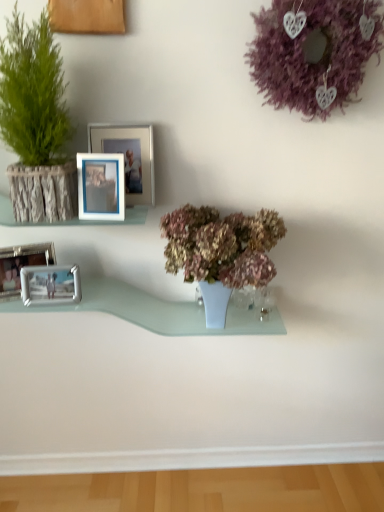
Question: From a real-world perspective, is purple matte wreath at upper right below metallic silver picture frame at left, the 3th picture frame viewed from the right?

Choices:
 (A) yes
 (B) no

Answer: (B)

Question: Considering the relative sizes of purple matte wreath at upper right and metallic silver picture frame at left, the second picture frame when ordered from left to right, in the image provided, is purple matte wreath at upper right thinner than metallic silver picture frame at left, the second picture frame when ordered from left to right,?

Choices:
 (A) no
 (B) yes

Answer: (A)

Question: Is purple matte wreath at upper right not near metallic silver picture frame at left, the 3th picture frame viewed from the right?

Choices:
 (A) no
 (B) yes

Answer: (A)

Question: Is purple matte wreath at upper right bigger than metallic silver picture frame at left, the second picture frame when ordered from left to right?

Choices:
 (A) no
 (B) yes

Answer: (B)

Question: Is purple matte wreath at upper right not inside metallic silver picture frame at left, the 3th picture frame viewed from the right?

Choices:
 (A) no
 (B) yes

Answer: (B)

Question: From the image's perspective, is purple matte wreath at upper right on metallic silver picture frame at left, the 3th picture frame viewed from the right?

Choices:
 (A) yes
 (B) no

Answer: (A)

Question: Is clear glass shelf at center wider than metallic silver picture frame at left, the 3th picture frame viewed from the right?

Choices:
 (A) yes
 (B) no

Answer: (A)

Question: Is clear glass shelf at center with metallic silver picture frame at left, the second picture frame when ordered from left to right?

Choices:
 (A) no
 (B) yes

Answer: (A)

Question: Is clear glass shelf at center positioned before metallic silver picture frame at left, the 3th picture frame viewed from the right?

Choices:
 (A) yes
 (B) no

Answer: (B)

Question: Is clear glass shelf at center positioned beyond the bounds of metallic silver picture frame at left, the 3th picture frame viewed from the right?

Choices:
 (A) yes
 (B) no

Answer: (A)

Question: Is clear glass shelf at center shorter than metallic silver picture frame at left, the 3th picture frame viewed from the right?

Choices:
 (A) no
 (B) yes

Answer: (A)

Question: Is clear glass shelf at center taller than metallic silver picture frame at left, the 3th picture frame viewed from the right?

Choices:
 (A) no
 (B) yes

Answer: (B)

Question: Can you confirm if wooden frame at left is positioned to the left of green textured plant at left, which is counted as the 2th houseplant, starting from the right?

Choices:
 (A) no
 (B) yes

Answer: (A)